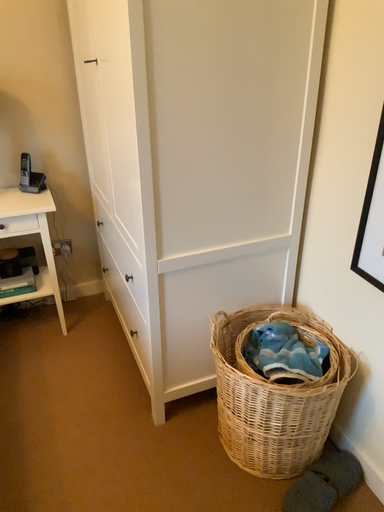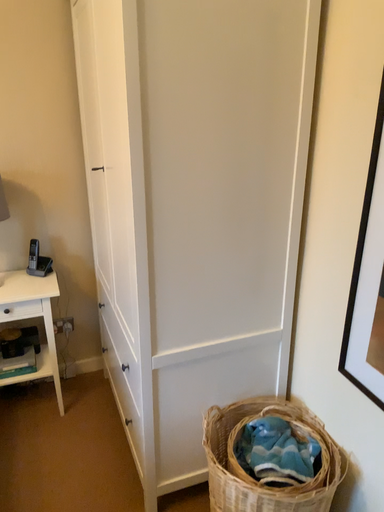
Question: How did the camera likely rotate when shooting the video?

Choices:
 (A) rotated downward
 (B) rotated upward

Answer: (B)